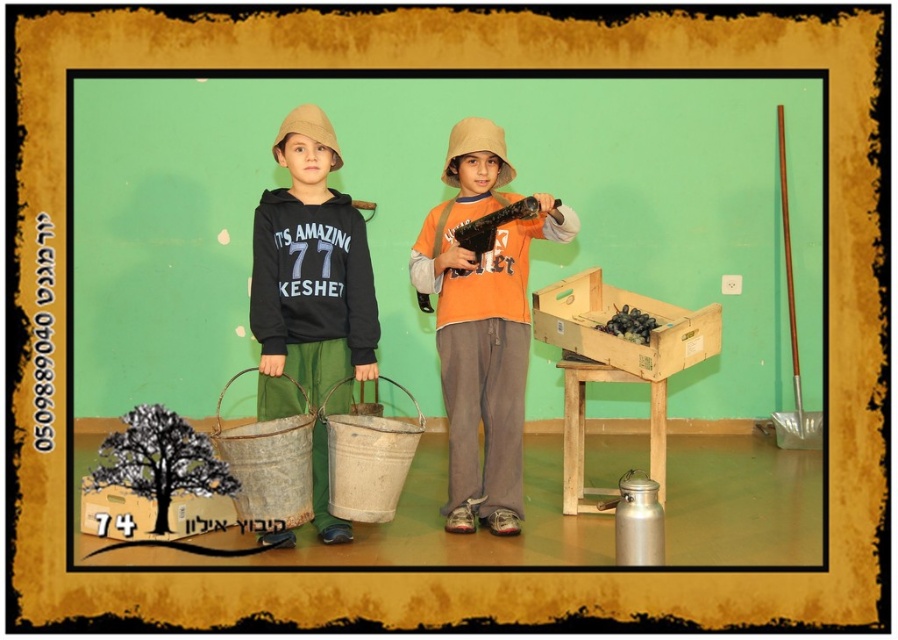
Which is behind, point (473, 401) or point (678, 310)?

Point (678, 310)

Who is more forward, (x=455, y=326) or (x=650, y=353)?

Point (x=455, y=326) is in front.

Find the location of a particular element. This screenshot has height=640, width=898. orange cotton shirt at center is located at coordinates (482, 324).

Can you confirm if matte black hoodie at center is bigger than wooden crate at center?

Actually, matte black hoodie at center might be smaller than wooden crate at center.

Identify the location of matte black hoodie at center. The width and height of the screenshot is (898, 640). (310, 276).

Locate an element on the screen. matte black hoodie at center is located at coordinates coord(310,276).

Is orange cotton shirt at center to the right of matte black hoodie at center from the viewer's perspective?

Yes, orange cotton shirt at center is to the right of matte black hoodie at center.

Find the location of a particular element. orange cotton shirt at center is located at coordinates (482, 324).

This screenshot has width=898, height=640. Identify the location of orange cotton shirt at center. (482, 324).